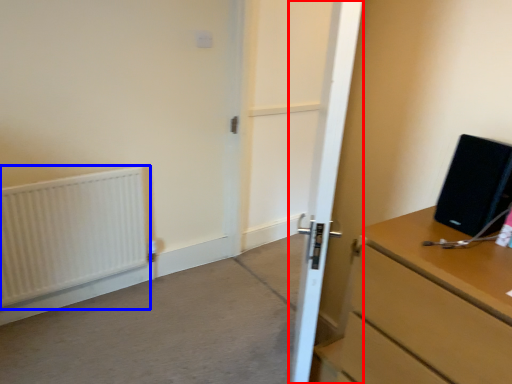
Question: Which of the following is the closest to the observer, door (highlighted by a red box) or radiator (highlighted by a blue box)?

Choices:
 (A) door
 (B) radiator

Answer: (A)